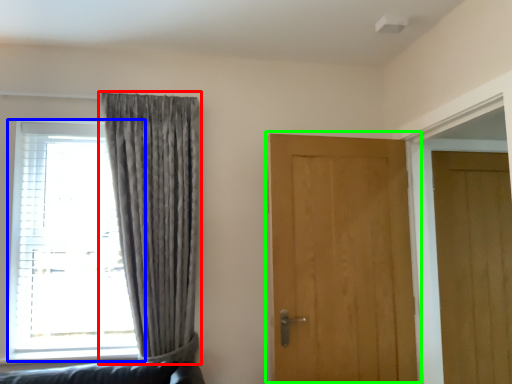
Question: Which object is the farthest from curtain (highlighted by a red box)? Choose among these: window (highlighted by a blue box) or door (highlighted by a green box).

Choices:
 (A) window
 (B) door

Answer: (B)